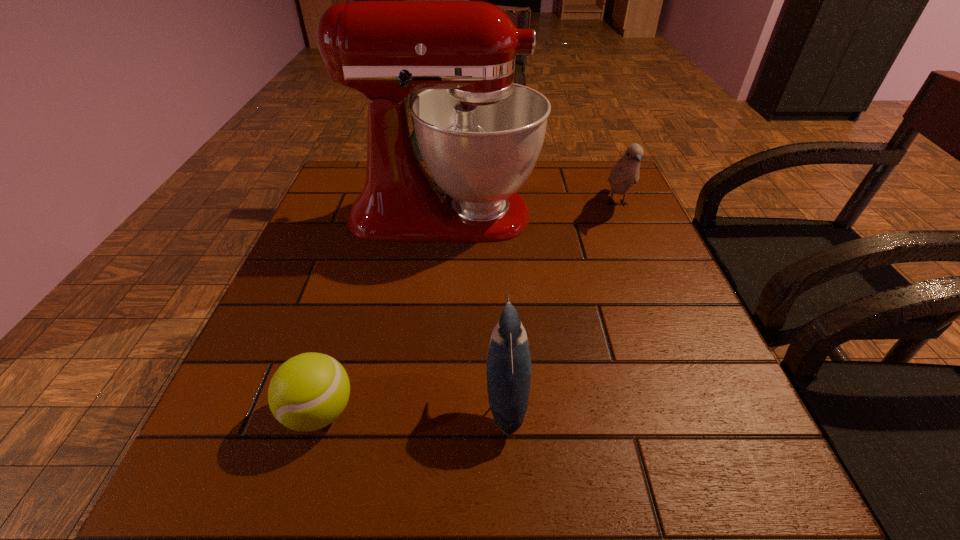
In order to click on vacant space at the left edge of the desktop in this screenshot , I will do [260, 396].

You are a GUI agent. You are given a task and a screenshot of the screen. Output one action in this format:
    pyautogui.click(x=<x>, y=<y>)
    Task: Click on the vacant space at the right edge of the desktop
    The width and height of the screenshot is (960, 540).
    Given the screenshot: What is the action you would take?
    pyautogui.click(x=689, y=404)

At what (x,y) coordinates should I click in order to perform the action: click on blank space at the far right corner of the desktop. Please return your answer as a coordinate pair (x, y). The image size is (960, 540). Looking at the image, I should click on (599, 191).

At what (x,y) coordinates should I click in order to perform the action: click on free point between the mixer and the left bird. Please return your answer as a coordinate pair (x, y). Image resolution: width=960 pixels, height=540 pixels. Looking at the image, I should click on (475, 306).

Find the location of a particular element. The height and width of the screenshot is (540, 960). vacant area that lies between the shortest object and the rightmost object is located at coordinates point(468,308).

At what (x,y) coordinates should I click in order to perform the action: click on free area in between the left bird and the tennis ball. Please return your answer as a coordinate pair (x, y). The width and height of the screenshot is (960, 540). Looking at the image, I should click on (413, 405).

You are a GUI agent. You are given a task and a screenshot of the screen. Output one action in this format:
    pyautogui.click(x=<x>, y=<y>)
    Task: Click on the free space between the right bird and the tennis ball
    This screenshot has width=960, height=540.
    Given the screenshot: What is the action you would take?
    pyautogui.click(x=468, y=308)

Locate an element on the screen. vacant region between the rightmost object and the tennis ball is located at coordinates (468, 308).

At what (x,y) coordinates should I click in order to perform the action: click on free space between the rightmost object and the shortest object. Please return your answer as a coordinate pair (x, y). The image size is (960, 540). Looking at the image, I should click on point(468,308).

This screenshot has width=960, height=540. What are the coordinates of `free space that is in between the rightmost object and the nearer bird` in the screenshot? It's located at (562, 301).